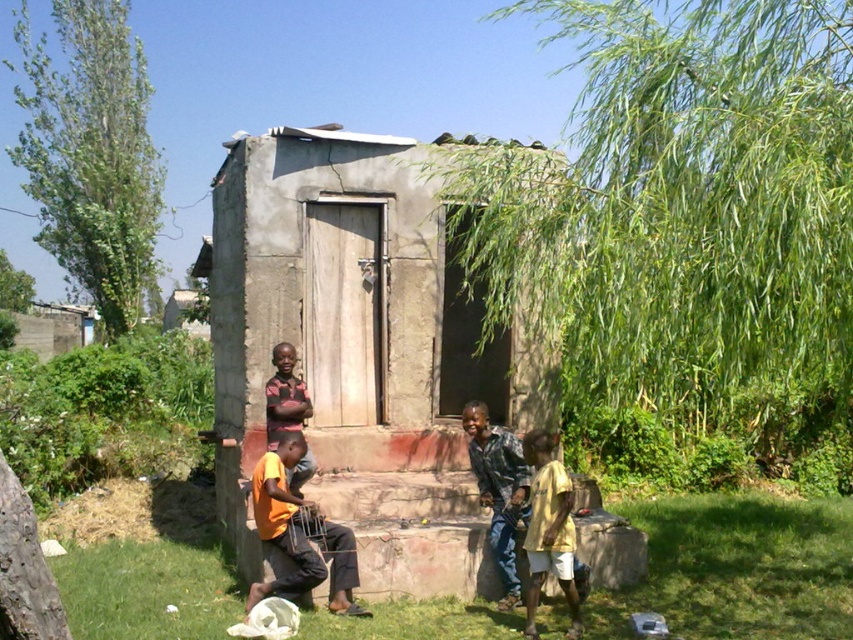
Between green grass at lower center and orange cotton shirt at lower center, which one has less height?

green grass at lower center

Which is below, green grass at lower center or orange cotton shirt at lower center?

green grass at lower center

Which is in front, point (164, 541) or point (299, 579)?

Point (299, 579) is in front.

Identify the location of green grass at lower center. (738, 570).

Does orange cotton shirt at lower center have a larger size compared to orange t-shirt at center?

Correct, orange cotton shirt at lower center is larger in size than orange t-shirt at center.

Can you confirm if orange cotton shirt at lower center is thinner than orange t-shirt at center?

No.

You are a GUI agent. You are given a task and a screenshot of the screen. Output one action in this format:
    pyautogui.click(x=<x>, y=<y>)
    Task: Click on the orange cotton shirt at lower center
    This screenshot has width=853, height=640.
    Given the screenshot: What is the action you would take?
    pyautogui.click(x=300, y=532)

Does gray concrete hut at center appear on the left side of yellow matte shirt at lower right?

Correct, you'll find gray concrete hut at center to the left of yellow matte shirt at lower right.

Image resolution: width=853 pixels, height=640 pixels. Describe the element at coordinates (346, 321) in the screenshot. I see `gray concrete hut at center` at that location.

Which is behind, point (305, 372) or point (537, 602)?

The point (305, 372) is behind.

Locate an element on the screen. This screenshot has height=640, width=853. gray concrete hut at center is located at coordinates (346, 321).